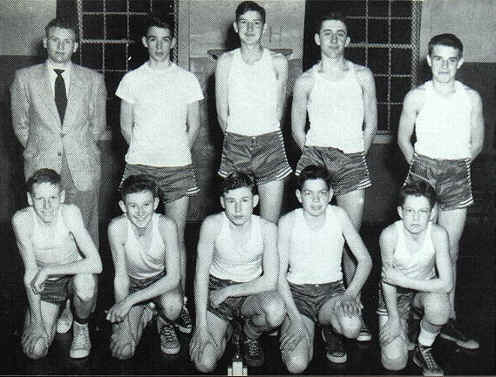
The width and height of the screenshot is (496, 377). Find the location of `floor`. floor is located at coordinates (467, 355).